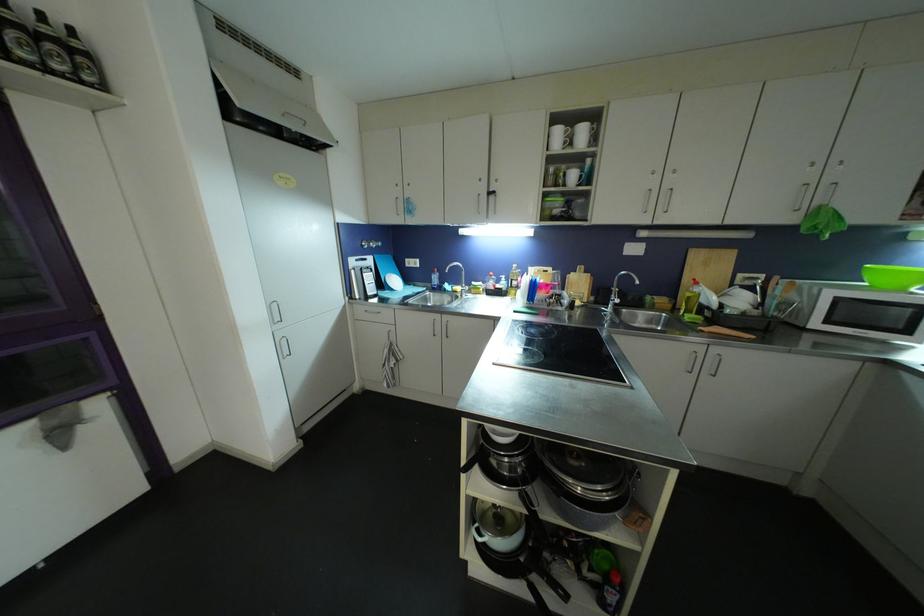
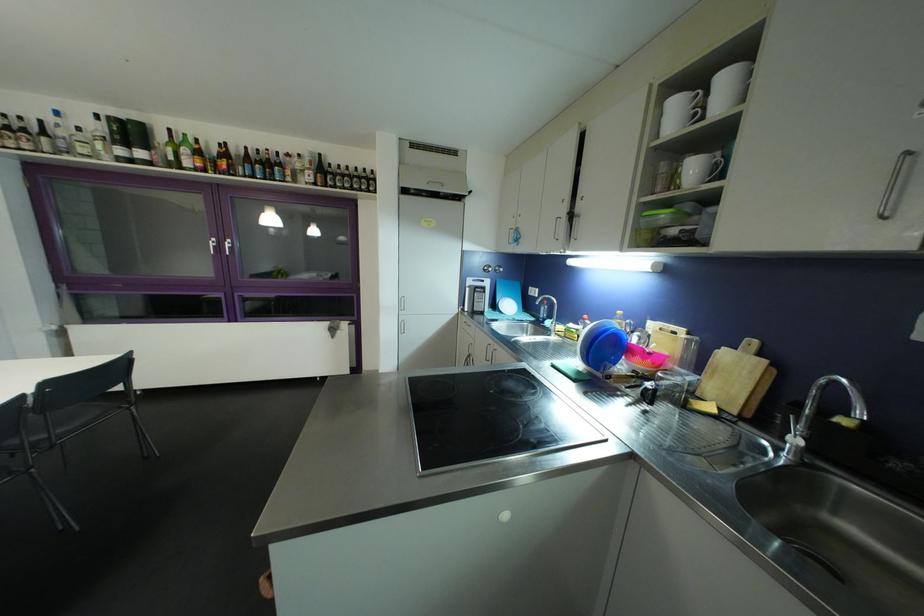
The point at [588,180] is marked in the first image. Where is the corresponding point in the second image?

(722, 169)